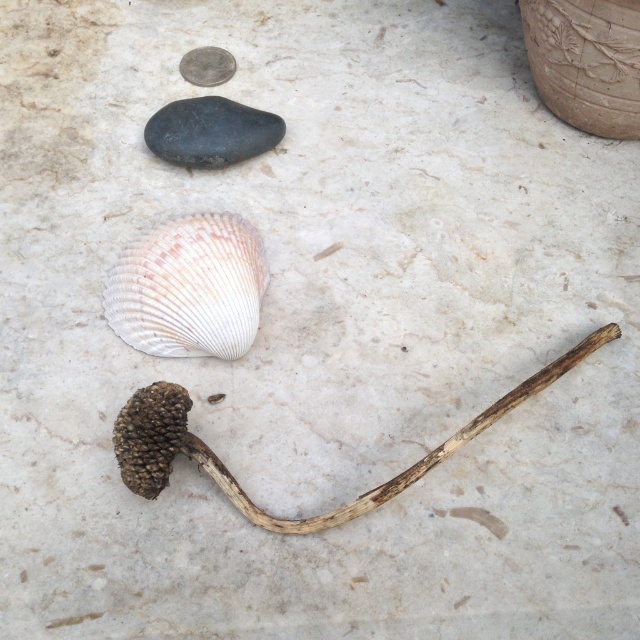
Can you confirm if pearly white shell at center is bigger than black smooth rock at upper left?

Correct, pearly white shell at center is larger in size than black smooth rock at upper left.

Between point (172, 250) and point (179, 108), which one is positioned behind?

Positioned behind is point (179, 108).

Locate an element on the screen. pearly white shell at center is located at coordinates click(x=189, y=288).

You are a GUI agent. You are given a task and a screenshot of the screen. Output one action in this format:
    pyautogui.click(x=<x>, y=<y>)
    Task: Click on the pearly white shell at center
    The image size is (640, 640).
    Given the screenshot: What is the action you would take?
    (x=189, y=288)

Is brown rough twig at center positioned at the back of black smooth rock at upper left?

No, it is in front of black smooth rock at upper left.

Can you confirm if brown rough twig at center is positioned below black smooth rock at upper left?

Correct, brown rough twig at center is located below black smooth rock at upper left.

What do you see at coordinates (236, 481) in the screenshot? The image size is (640, 640). I see `brown rough twig at center` at bounding box center [236, 481].

Locate an element on the screen. brown rough twig at center is located at coordinates (236, 481).

Is point (177, 308) in front of point (131, 420)?

No, it is behind (131, 420).

Locate an element on the screen. The height and width of the screenshot is (640, 640). pearly white shell at center is located at coordinates (189, 288).